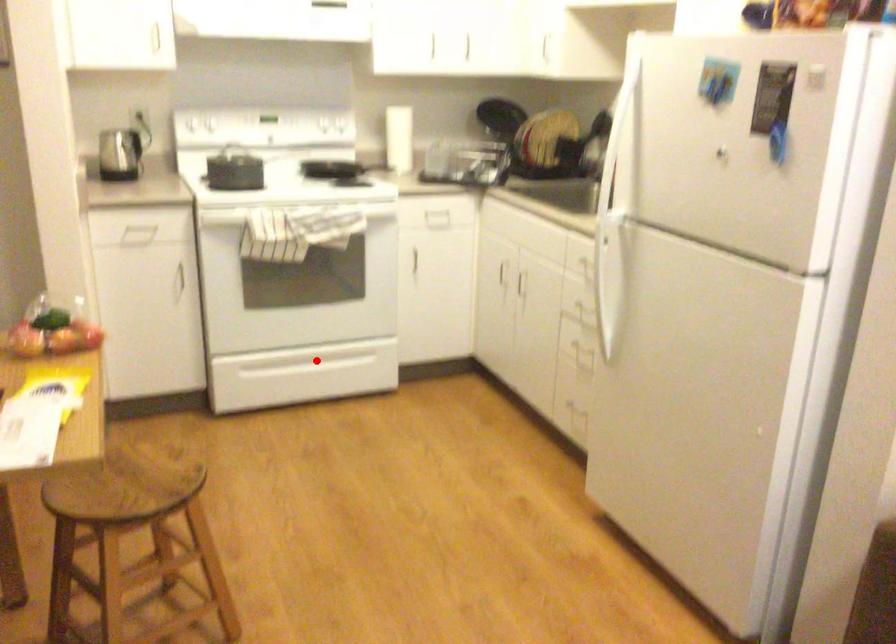
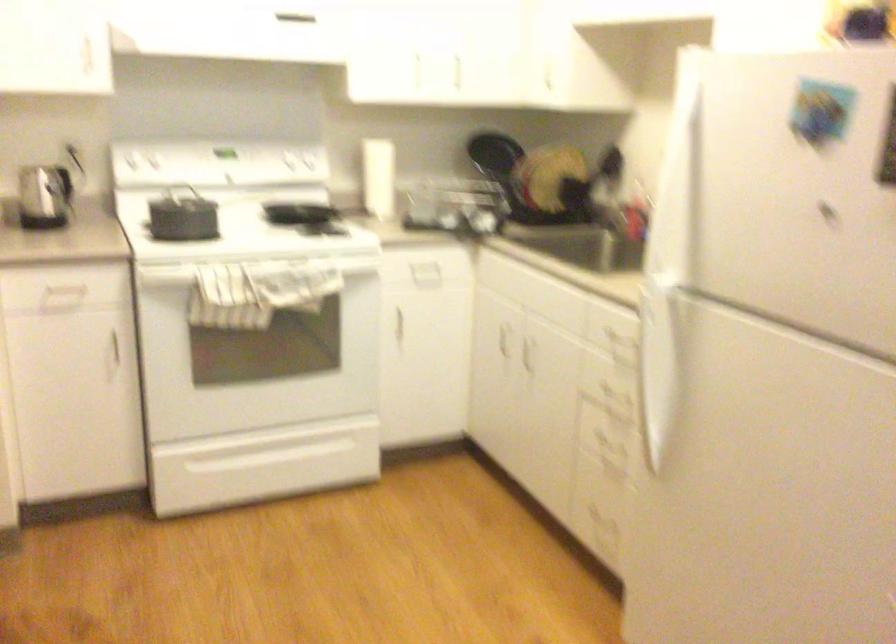
Where in the second image is the point corresponding to the highlighted location from the first image?

(280, 446)